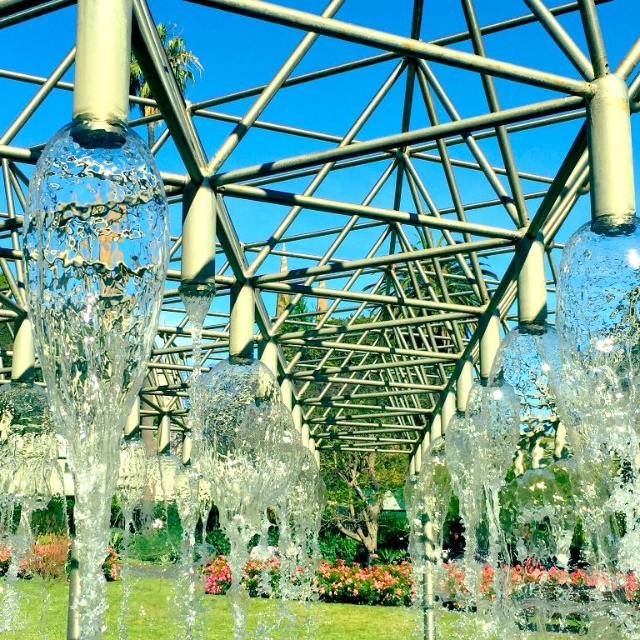
Can you confirm if transparent glass water at center left is shorter than floral vibrant petals at center?

Yes.

Describe the element at coordinates (93, 310) in the screenshot. I see `transparent glass water at center left` at that location.

Does point (48, 285) come closer to viewer compared to point (483, 572)?

Yes, point (48, 285) is closer to viewer.

At what (x,y) coordinates should I click in order to perform the action: click on transparent glass water at center left. Please return your answer as a coordinate pair (x, y). Image resolution: width=640 pixels, height=640 pixels. Looking at the image, I should click on (93, 310).